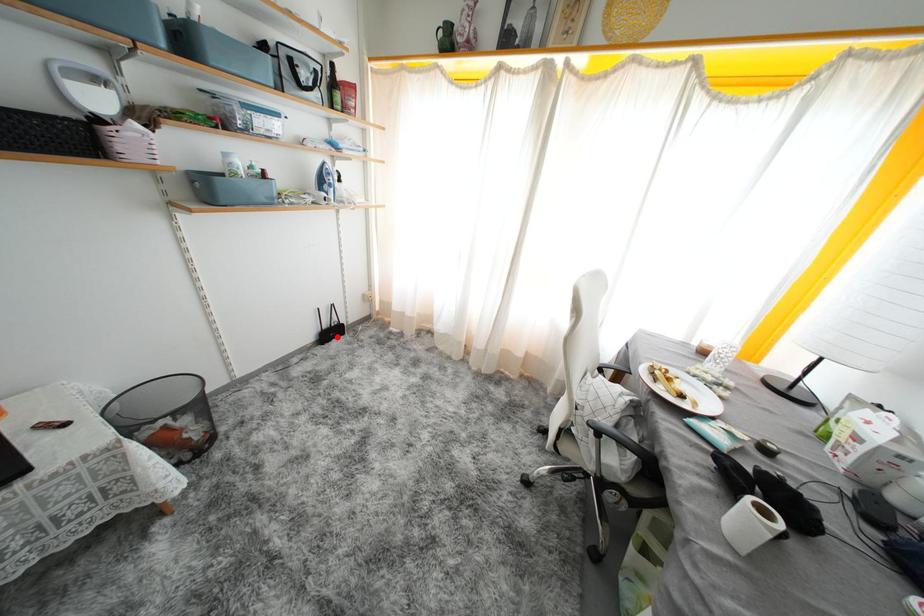
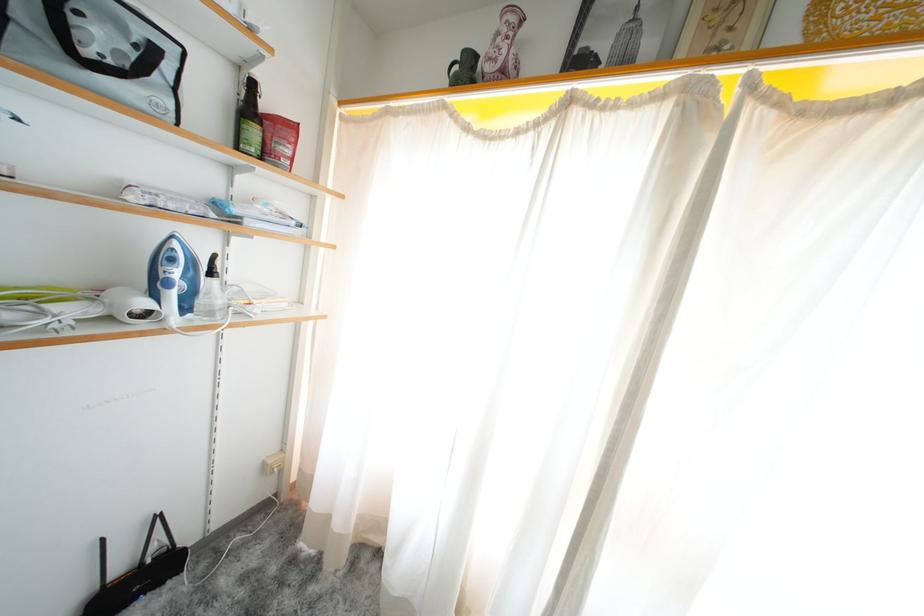
Question: I am providing you with two images of the same scene from different viewpoints. Given a red point in image1, look at the same physical point in image2. Is it:

Choices:
 (A) Closer to the viewpoint
 (B) Farther from the viewpoint

Answer: (B)